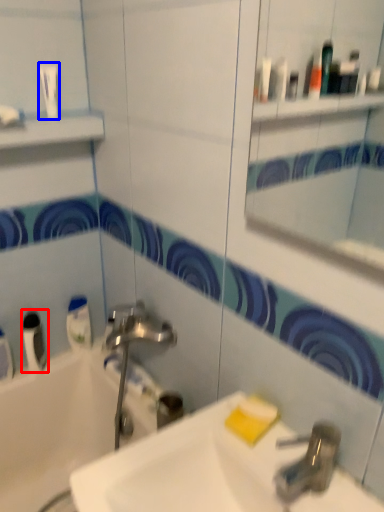
Question: Which point is further to the camera, mouthwash (highlighted by a red box) or toiletry (highlighted by a blue box)?

Choices:
 (A) mouthwash
 (B) toiletry

Answer: (A)